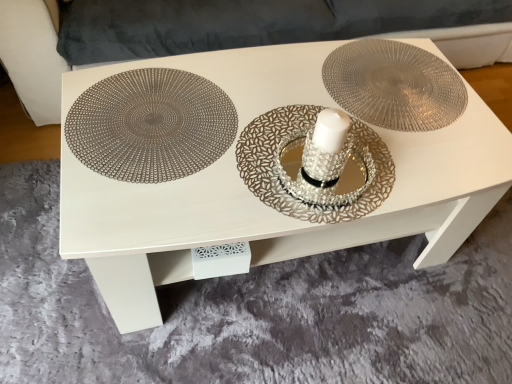
In order to click on vacant space in metallic woven placemat at left (from a real-world perspective) in this screenshot , I will do `click(157, 124)`.